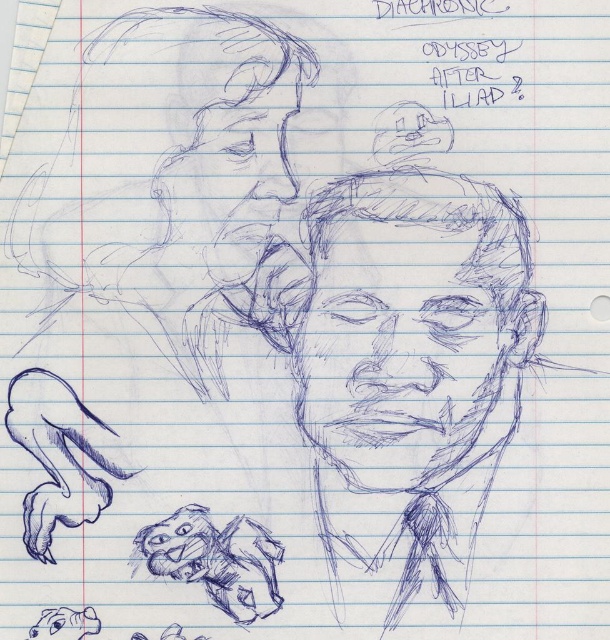
Question: Which of the following is the closest to the observer?

Choices:
 (A) (337, 376)
 (B) (284, 88)

Answer: (B)

Question: Is blue pencil sketch face at center to the left of blue sketchy face at upper left from the viewer's perspective?

Choices:
 (A) no
 (B) yes

Answer: (A)

Question: Does blue pencil sketch face at center appear on the right side of blue sketchy face at upper left?

Choices:
 (A) no
 (B) yes

Answer: (B)

Question: Which of the following is the farthest from the observer?

Choices:
 (A) blue sketchy face at upper left
 (B) blue pencil sketch face at center

Answer: (B)

Question: Which point is farther from the camera taking this photo?

Choices:
 (A) (461, 246)
 (B) (273, 67)

Answer: (A)

Question: Is blue pencil sketch face at center to the right of blue sketchy face at upper left from the viewer's perspective?

Choices:
 (A) no
 (B) yes

Answer: (B)